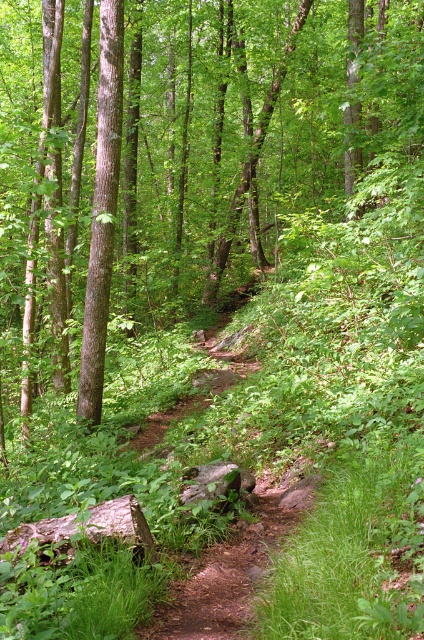
Who is more forward, (318, 86) or (92, 228)?

Positioned in front is point (92, 228).

Does point (84, 24) come in front of point (106, 188)?

No, it is not.

Between point (290, 29) and point (103, 74), which one is positioned behind?

The point (290, 29) is behind.

Find the location of a particular element. green leafy tree at center is located at coordinates (186, 154).